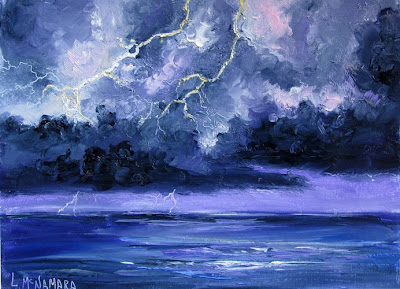
The width and height of the screenshot is (400, 289). I want to click on canvas, so click(158, 33).